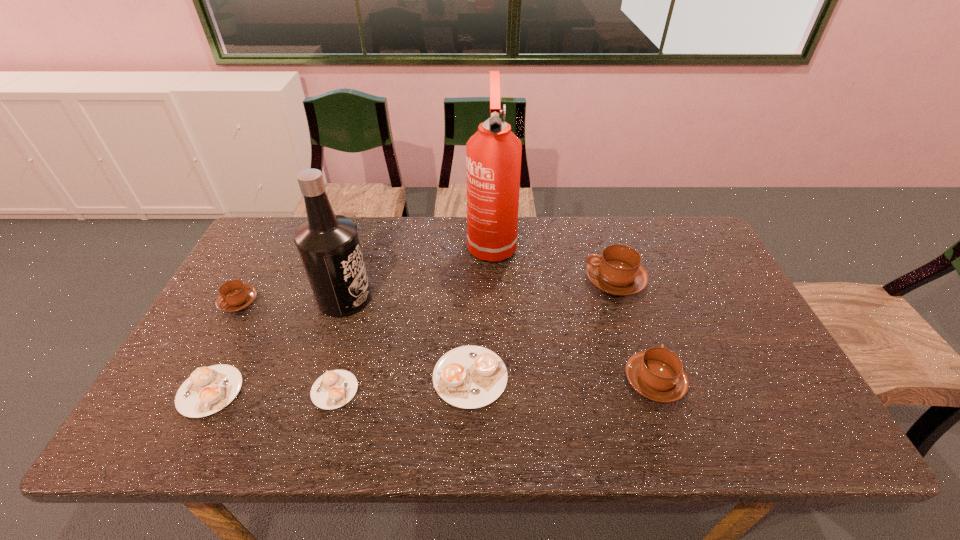
The height and width of the screenshot is (540, 960). I want to click on the fourth tallest cappuccino, so click(x=469, y=377).

The width and height of the screenshot is (960, 540). Find the location of `the third cappuccino from right to left`. the third cappuccino from right to left is located at coordinates (469, 377).

Locate an element on the screen. This screenshot has width=960, height=540. the fifth tallest cappuccino is located at coordinates (209, 389).

Locate an element on the screen. The width and height of the screenshot is (960, 540). the second shortest object is located at coordinates (209, 389).

Find the location of a particular element. The width and height of the screenshot is (960, 540). the shortest cappuccino is located at coordinates (333, 389).

This screenshot has width=960, height=540. Find the location of `the fourth cappuccino from right to left`. the fourth cappuccino from right to left is located at coordinates (333, 389).

Image resolution: width=960 pixels, height=540 pixels. I want to click on vacant area located 0.360m at the nozzle of the red fire extinguisher, so click(x=494, y=362).

The height and width of the screenshot is (540, 960). Identify the location of blank space located 0.090m on the front label of the second tallest object. (403, 298).

Locate an element on the screen. The width and height of the screenshot is (960, 540). free spot located 0.310m on the side of the tallest cappuccino with the handle is located at coordinates (x=481, y=280).

In order to click on free spot located on the side of the tallest cappuccino with the handle in this screenshot , I will do `click(508, 280)`.